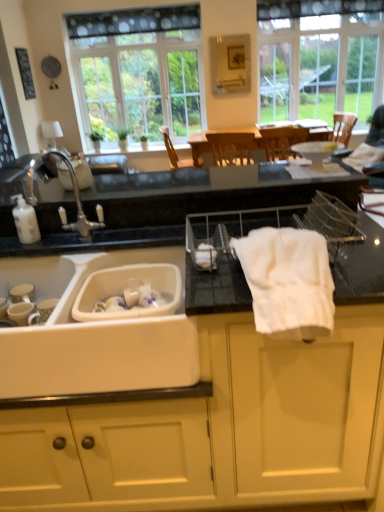
Question: Is clear glass window at upper right, acting as the 1th window starting from the right, positioned beyond the bounds of white plastic sink at lower left?

Choices:
 (A) no
 (B) yes

Answer: (B)

Question: Is clear glass window at upper right, the 2th window viewed from the left, in contact with white plastic sink at lower left?

Choices:
 (A) yes
 (B) no

Answer: (B)

Question: Does clear glass window at upper right, the 2th window viewed from the left, have a larger size compared to white plastic sink at lower left?

Choices:
 (A) no
 (B) yes

Answer: (B)

Question: Does clear glass window at upper right, the 2th window viewed from the left, have a greater width compared to white plastic sink at lower left?

Choices:
 (A) no
 (B) yes

Answer: (A)

Question: Is clear glass window at upper right, acting as the 1th window starting from the right, not near white plastic sink at lower left?

Choices:
 (A) yes
 (B) no

Answer: (A)

Question: Considering the positions of clear glass window at upper center, placed as the 1th window when sorted from left to right, and white cotton bath towel at center in the image, is clear glass window at upper center, placed as the 1th window when sorted from left to right, wider or thinner than white cotton bath towel at center?

Choices:
 (A) wide
 (B) thin

Answer: (B)

Question: From the image's perspective, relative to white cotton bath towel at center, is clear glass window at upper center, marked as the second window in a right-to-left arrangement, above or below?

Choices:
 (A) below
 (B) above

Answer: (B)

Question: From a real-world perspective, is clear glass window at upper center, placed as the 1th window when sorted from left to right, physically located above or below white cotton bath towel at center?

Choices:
 (A) above
 (B) below

Answer: (A)

Question: Is clear glass window at upper center, marked as the second window in a right-to-left arrangement, inside or outside of white cotton bath towel at center?

Choices:
 (A) inside
 (B) outside

Answer: (B)

Question: From a real-world perspective, is white matte cabinet at center above or below white plastic soap dispenser at left?

Choices:
 (A) below
 (B) above

Answer: (A)

Question: Considering their positions, is white matte cabinet at center located in front of or behind white plastic soap dispenser at left?

Choices:
 (A) behind
 (B) front

Answer: (B)

Question: From the image's perspective, is white matte cabinet at center located above or below white plastic soap dispenser at left?

Choices:
 (A) below
 (B) above

Answer: (A)

Question: Would you say white matte cabinet at center is to the left or to the right of white plastic soap dispenser at left in the picture?

Choices:
 (A) right
 (B) left

Answer: (A)

Question: Considering the positions of point (125, 372) and point (24, 236), is point (125, 372) closer or farther from the camera than point (24, 236)?

Choices:
 (A) closer
 (B) farther

Answer: (A)

Question: Do you think white plastic sink at lower left is within white plastic soap dispenser at left, or outside of it?

Choices:
 (A) outside
 (B) inside

Answer: (A)